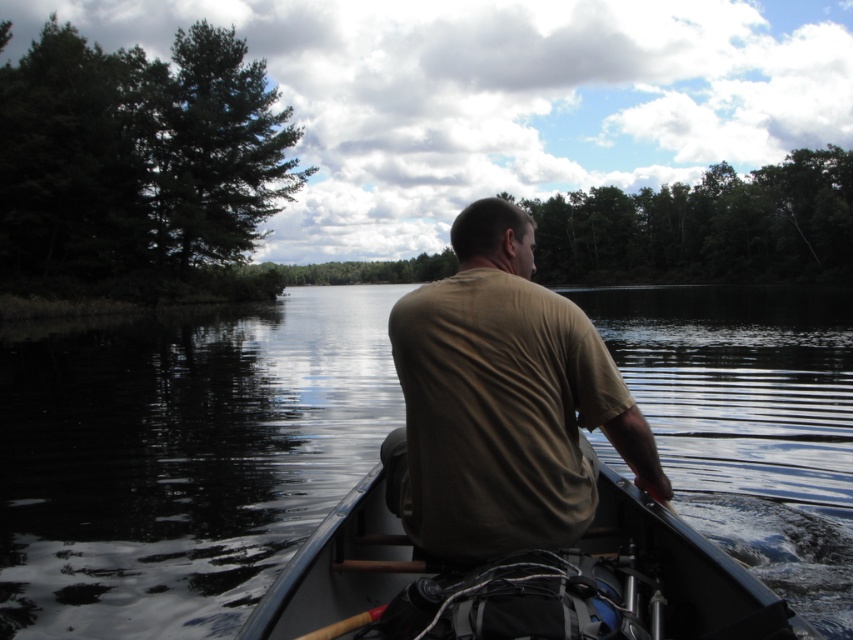
Question: Which object appears farthest from the camera in this image?

Choices:
 (A) gray plastic canoe at center
 (B) tan cotton shirt at center

Answer: (B)

Question: Can you confirm if black water at center is positioned to the left of tan cotton shirt at center?

Choices:
 (A) no
 (B) yes

Answer: (A)

Question: From the image, what is the correct spatial relationship of black water at center in relation to tan cotton shirt at center?

Choices:
 (A) right
 (B) left

Answer: (A)

Question: Where is tan cotton shirt at center located in relation to gray plastic canoe at center in the image?

Choices:
 (A) left
 (B) right

Answer: (B)

Question: Which is farther from the black water at center?

Choices:
 (A) tan cotton shirt at center
 (B) gray plastic canoe at center

Answer: (A)

Question: Which object is positioned closest to the gray plastic canoe at center?

Choices:
 (A) tan cotton shirt at center
 (B) black water at center

Answer: (A)